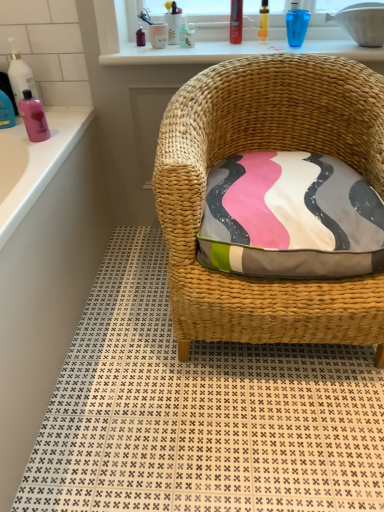
Question: Is woven wicker chair at center to the left of translucent yellow bottle at upper center, acting as the second toiletry starting from the right, from the viewer's perspective?

Choices:
 (A) no
 (B) yes

Answer: (A)

Question: Does woven wicker chair at center have a lesser height compared to translucent yellow bottle at upper center, the second toiletry viewed from the left?

Choices:
 (A) yes
 (B) no

Answer: (B)

Question: Does woven wicker chair at center appear on the right side of translucent yellow bottle at upper center, the second toiletry viewed from the left?

Choices:
 (A) no
 (B) yes

Answer: (B)

Question: Is woven wicker chair at center not close to translucent yellow bottle at upper center, the second toiletry viewed from the left?

Choices:
 (A) no
 (B) yes

Answer: (A)

Question: Is woven wicker chair at center further to the viewer compared to translucent yellow bottle at upper center, the second toiletry viewed from the left?

Choices:
 (A) yes
 (B) no

Answer: (B)

Question: Is woven wicker chair at center outside of translucent yellow bottle at upper center, the second toiletry viewed from the left?

Choices:
 (A) no
 (B) yes

Answer: (B)

Question: From a real-world perspective, is woven wicker chair at center beneath shiny plastic tube at upper center, placed as the 3th toiletry when sorted from right to left?

Choices:
 (A) yes
 (B) no

Answer: (A)

Question: Does woven wicker chair at center have a greater width compared to shiny plastic tube at upper center, placed as the 3th toiletry when sorted from right to left?

Choices:
 (A) yes
 (B) no

Answer: (A)

Question: Is the surface of woven wicker chair at center in direct contact with shiny plastic tube at upper center, placed as the 3th toiletry when sorted from right to left?

Choices:
 (A) no
 (B) yes

Answer: (A)

Question: Would you say woven wicker chair at center is a long distance from shiny plastic tube at upper center, the first toiletry viewed from the left?

Choices:
 (A) no
 (B) yes

Answer: (A)

Question: Is woven wicker chair at center surrounding shiny plastic tube at upper center, the first toiletry viewed from the left?

Choices:
 (A) yes
 (B) no

Answer: (B)

Question: Considering the relative positions of woven wicker chair at center and shiny plastic tube at upper center, placed as the 3th toiletry when sorted from right to left, in the image provided, is woven wicker chair at center to the right of shiny plastic tube at upper center, placed as the 3th toiletry when sorted from right to left, from the viewer's perspective?

Choices:
 (A) no
 (B) yes

Answer: (B)

Question: Considering the relative sizes of translucent plastic bottle at left, which is the first cleaning product in top-to-bottom order, and woven wicker chair at center in the image provided, is translucent plastic bottle at left, which is the first cleaning product in top-to-bottom order, wider than woven wicker chair at center?

Choices:
 (A) yes
 (B) no

Answer: (B)